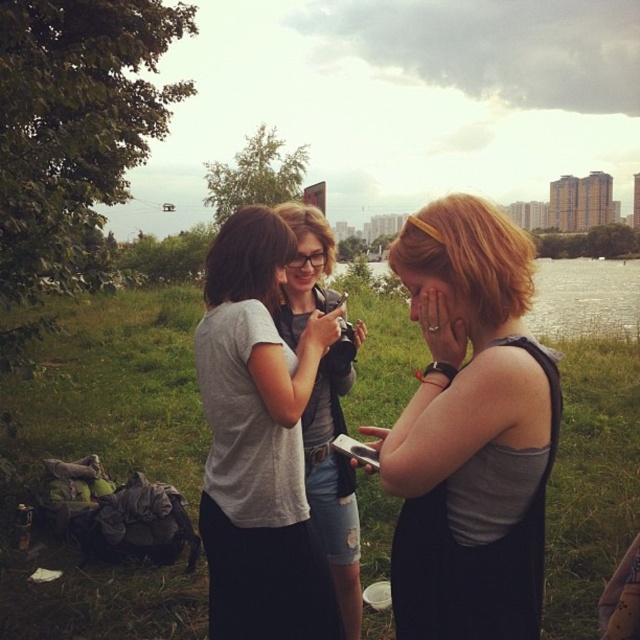
Question: Which is nearer to the gray cotton t-shirt at center?

Choices:
 (A) transparent water at center
 (B) matte black phone at center
 (C) matte gray tank top at center

Answer: (B)

Question: Can you confirm if matte gray tank top at center is positioned below gray cotton t-shirt at center?

Choices:
 (A) no
 (B) yes

Answer: (A)

Question: Which of the following is the closest to the observer?

Choices:
 (A) gray cotton t-shirt at center
 (B) matte black phone at center
 (C) transparent water at center
 (D) matte gray tank top at center

Answer: (D)

Question: Estimate the real-world distances between objects in this image. Which object is farther from the matte gray tank top at center?

Choices:
 (A) gray cotton t-shirt at center
 (B) matte black phone at center
 (C) transparent water at center

Answer: (C)

Question: Does matte gray tank top at center have a greater width compared to gray cotton t-shirt at center?

Choices:
 (A) no
 (B) yes

Answer: (A)

Question: Can you confirm if gray cotton t-shirt at center is smaller than transparent water at center?

Choices:
 (A) yes
 (B) no

Answer: (A)